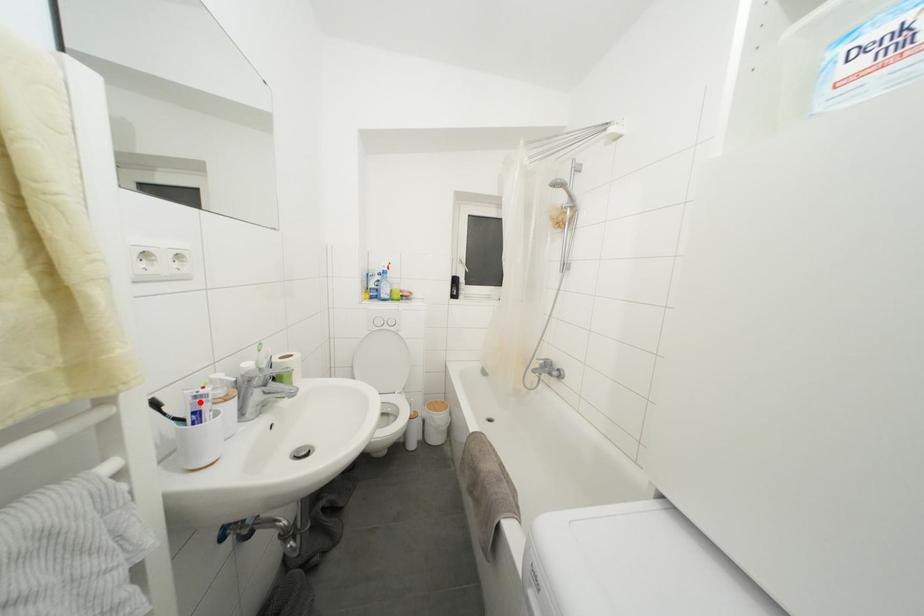
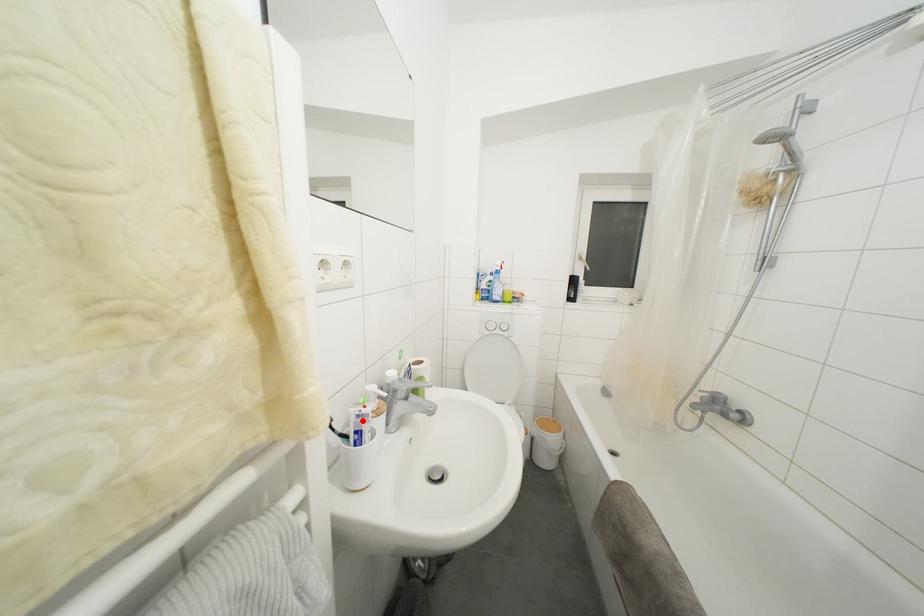
I am providing you with two images of the same scene from different viewpoints. A red point is marked on the first image and another point is marked on the second image. Is the marked point in image1 the same physical position as the marked point in image2?

Yes